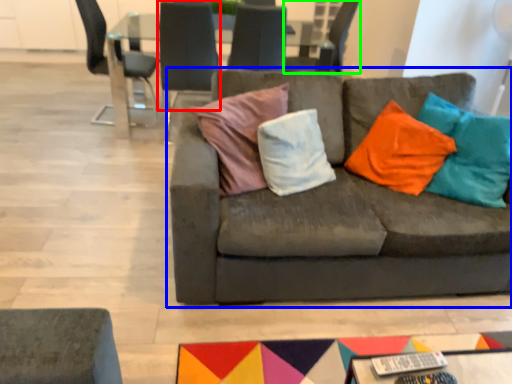
Question: Based on their relative distances, which object is nearer to chair (highlighted by a red box)? Choose from studio couch (highlighted by a blue box) and chair (highlighted by a green box).

Choices:
 (A) studio couch
 (B) chair

Answer: (B)